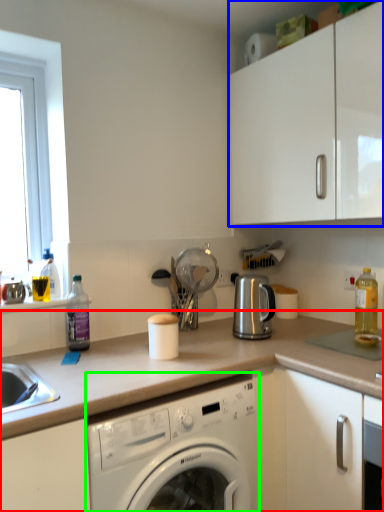
Question: Which is farther away from countertop (highlighted by a red box)? cabinetry (highlighted by a blue box) or washing machine (highlighted by a green box)?

Choices:
 (A) cabinetry
 (B) washing machine

Answer: (A)